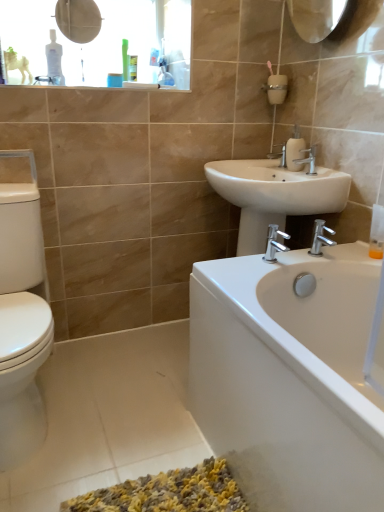
Question: From the image's perspective, does white glossy bathtub at lower right appear lower than matte plastic medicine cabinet at upper left?

Choices:
 (A) yes
 (B) no

Answer: (A)

Question: Considering the relative sizes of white glossy bathtub at lower right and matte plastic medicine cabinet at upper left in the image provided, is white glossy bathtub at lower right bigger than matte plastic medicine cabinet at upper left?

Choices:
 (A) yes
 (B) no

Answer: (A)

Question: Considering the relative sizes of white glossy bathtub at lower right and matte plastic medicine cabinet at upper left in the image provided, is white glossy bathtub at lower right taller than matte plastic medicine cabinet at upper left?

Choices:
 (A) yes
 (B) no

Answer: (A)

Question: Considering the relative sizes of white glossy bathtub at lower right and matte plastic medicine cabinet at upper left in the image provided, is white glossy bathtub at lower right wider than matte plastic medicine cabinet at upper left?

Choices:
 (A) no
 (B) yes

Answer: (B)

Question: From a real-world perspective, does white glossy bathtub at lower right stand above matte plastic medicine cabinet at upper left?

Choices:
 (A) yes
 (B) no

Answer: (B)

Question: Does white glossy bathtub at lower right have a lesser height compared to matte plastic medicine cabinet at upper left?

Choices:
 (A) no
 (B) yes

Answer: (A)

Question: Does matte plastic medicine cabinet at upper left have a larger size compared to silver metallic faucet at lower right, the 2th tap viewed from the top?

Choices:
 (A) no
 (B) yes

Answer: (B)

Question: Considering the relative sizes of matte plastic medicine cabinet at upper left and silver metallic faucet at lower right, the 2th tap viewed from the top, in the image provided, is matte plastic medicine cabinet at upper left smaller than silver metallic faucet at lower right, the 2th tap viewed from the top,?

Choices:
 (A) yes
 (B) no

Answer: (B)

Question: Does matte plastic medicine cabinet at upper left have a greater height compared to silver metallic faucet at lower right, the 1th tap from the bottom?

Choices:
 (A) no
 (B) yes

Answer: (B)

Question: Is there a large distance between matte plastic medicine cabinet at upper left and silver metallic faucet at lower right, marked as the second tap in a back-to-front arrangement?

Choices:
 (A) yes
 (B) no

Answer: (A)

Question: From a real-world perspective, does matte plastic medicine cabinet at upper left sit lower than silver metallic faucet at lower right, marked as the second tap in a back-to-front arrangement?

Choices:
 (A) no
 (B) yes

Answer: (A)

Question: Does matte plastic medicine cabinet at upper left lie behind silver metallic faucet at lower right, the 1th tap from the bottom?

Choices:
 (A) yes
 (B) no

Answer: (A)

Question: Does translucent plastic soap dispenser at right appear on the right side of white glossy bathtub at lower right?

Choices:
 (A) yes
 (B) no

Answer: (A)